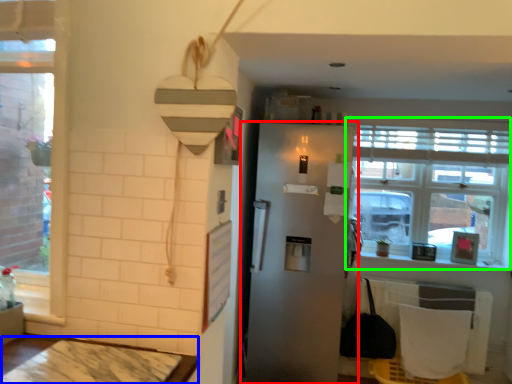
Question: Which object is positioned closest to refrigerator (highlighted by a red box)? Select from table (highlighted by a blue box) and window (highlighted by a green box).

Choices:
 (A) table
 (B) window

Answer: (B)